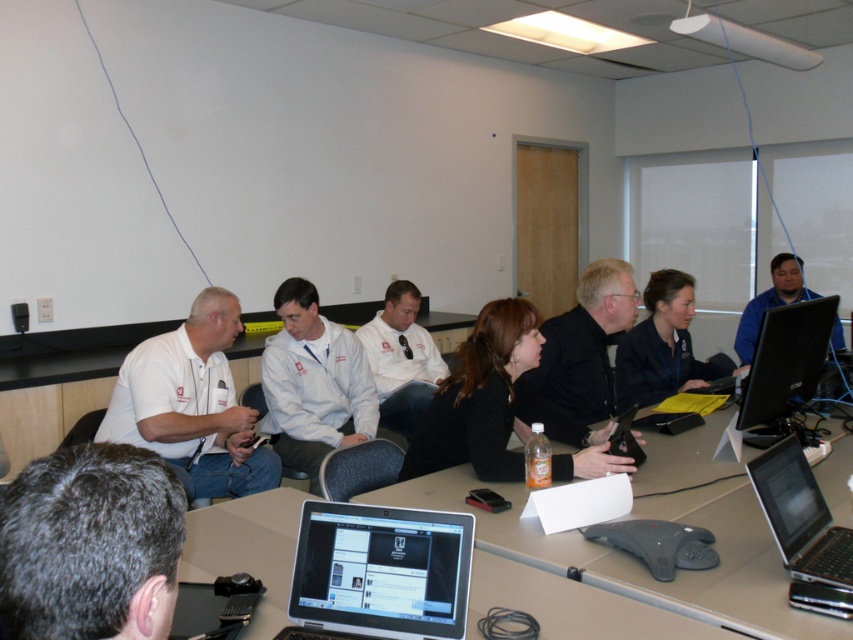
Describe the element at coordinates (381, 570) in the screenshot. This screenshot has height=640, width=853. I see `silver metallic laptop at center` at that location.

Is point (396, 576) closer to viewer compared to point (628, 282)?

Yes, point (396, 576) is in front of point (628, 282).

Does point (350, 598) come farther from viewer compared to point (560, 368)?

No, it is not.

What are the coordinates of `silver metallic laptop at center` in the screenshot? It's located at [381, 570].

Is the position of silver metallic table at center less distant than that of black matte jacket at center?

That is True.

Can you confirm if silver metallic table at center is bigger than black matte jacket at center?

No.

Identify the location of silver metallic table at center. The width and height of the screenshot is (853, 640). (573, 605).

Is gray hair at lower left thinner than silver metallic table at center?

Yes, gray hair at lower left is thinner than silver metallic table at center.

Who is taller, gray hair at lower left or silver metallic table at center?

Standing taller between the two is gray hair at lower left.

Is point (38, 499) positioned in front of point (471, 600)?

Yes.

At what (x,y) coordinates should I click in order to perform the action: click on gray hair at lower left. Please return your answer as a coordinate pair (x, y). This screenshot has width=853, height=640. Looking at the image, I should click on (90, 545).